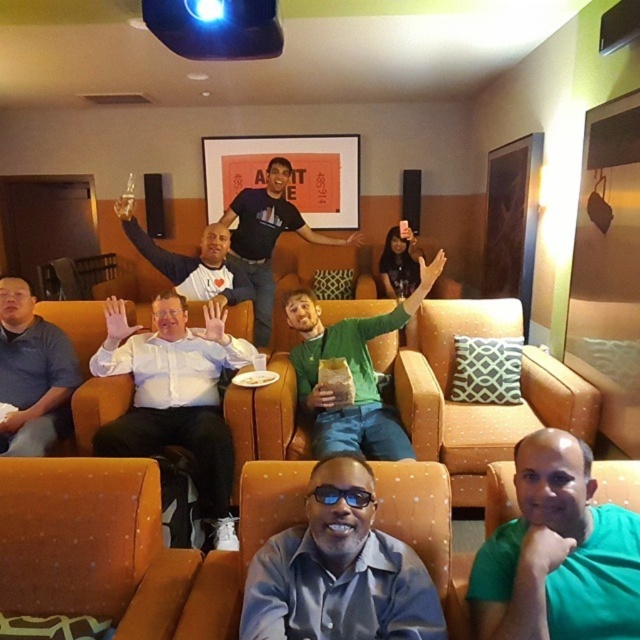
Question: Can you confirm if matte blue shirt at center is positioned to the right of white glossy shirt at center?

Choices:
 (A) no
 (B) yes

Answer: (B)

Question: Which point is farther to the camera?

Choices:
 (A) black plastic goggles at center
 (B) green matte shirt at lower right
 (C) white glossy shirt at center
 (D) dark blue sweater at center

Answer: (D)

Question: Considering the real-world distances, which object is farthest from the matte blue shirt at center?

Choices:
 (A) matte blue polo shirt at left
 (B) green matte shirt at lower right
 (C) orange fabric armchair at center

Answer: (A)

Question: Is green matte shirt at lower right thinner than white glossy shirt at center?

Choices:
 (A) yes
 (B) no

Answer: (A)

Question: Is orange fabric armchair at lower left smaller than orange fabric armchair at center?

Choices:
 (A) yes
 (B) no

Answer: (A)

Question: Which of the following is the farthest from the observer?

Choices:
 (A) dark blue sweater at center
 (B) orange fabric armchair at center

Answer: (A)